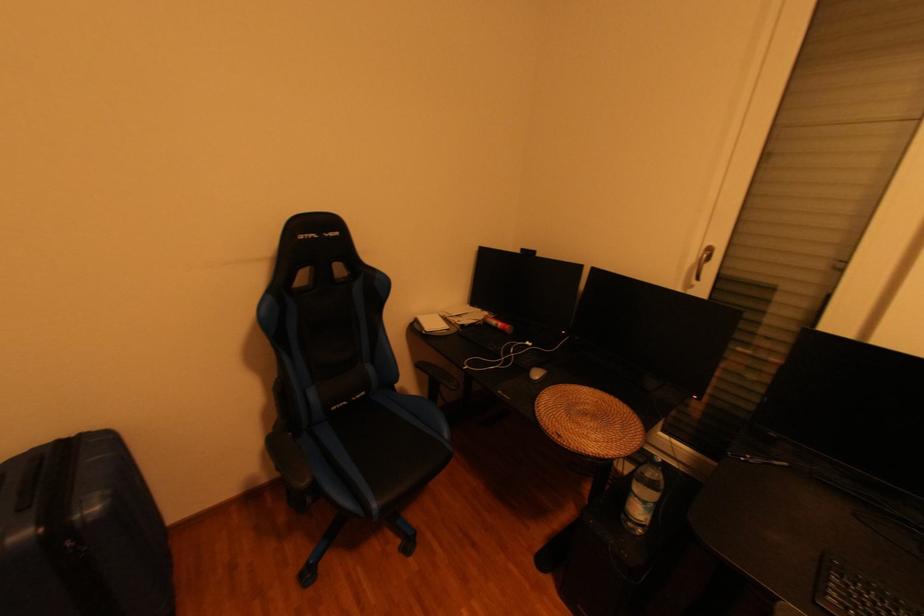
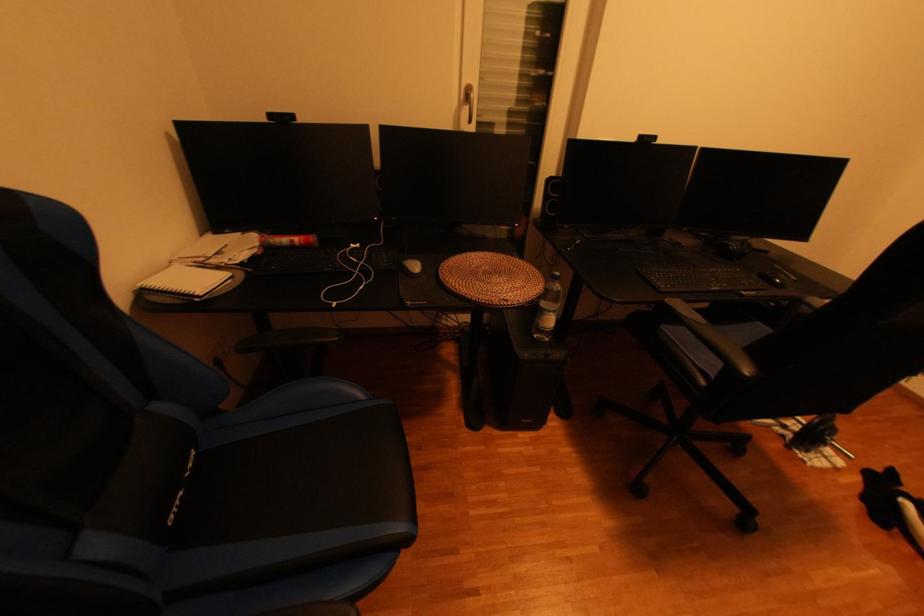
In the second image, find the point that corresponds to pixel 363 399 in the first image.

(197, 477)